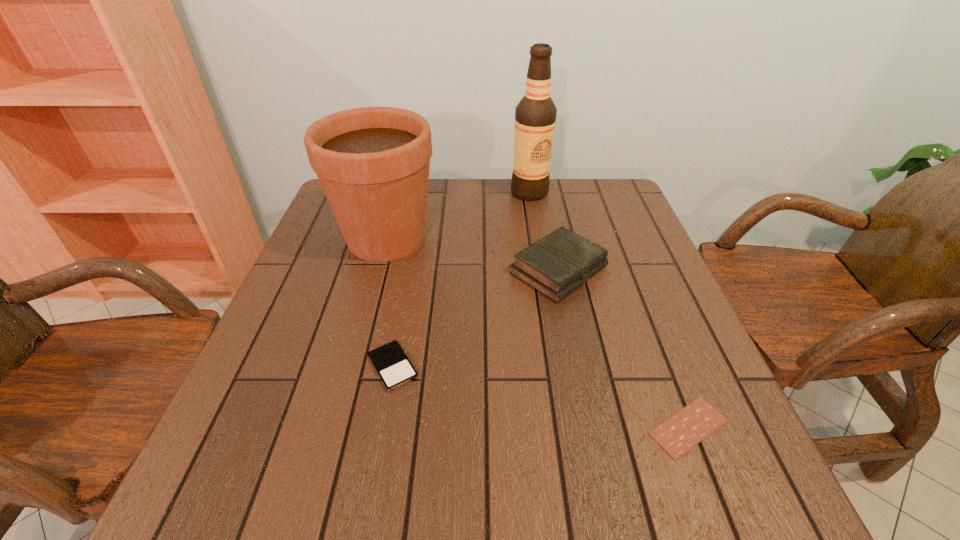
In the image, there is a desktop. Where is `vacant space at the near edge`? vacant space at the near edge is located at coordinates (547, 504).

Identify the location of vacant space at the left edge. (304, 251).

The width and height of the screenshot is (960, 540). Find the location of `free region at the right edge`. free region at the right edge is located at coordinates (731, 428).

This screenshot has height=540, width=960. What are the coordinates of `vacant area that lies between the book and the chocolate bar` in the screenshot? It's located at (624, 348).

The height and width of the screenshot is (540, 960). In order to click on free space between the nearest object and the flowerpot in this screenshot , I will do `click(538, 332)`.

Where is `free space that is in between the shortest object and the book`? The image size is (960, 540). free space that is in between the shortest object and the book is located at coordinates (624, 348).

Image resolution: width=960 pixels, height=540 pixels. I want to click on free space that is in between the third tallest object and the nearest object, so click(624, 348).

Identify the location of empty location between the farthest object and the nearest object. (609, 309).

I want to click on vacant space that's between the iPod and the nearest object, so click(x=540, y=396).

Where is `free space between the shortest object and the third shortest object`? This screenshot has height=540, width=960. free space between the shortest object and the third shortest object is located at coordinates (624, 348).